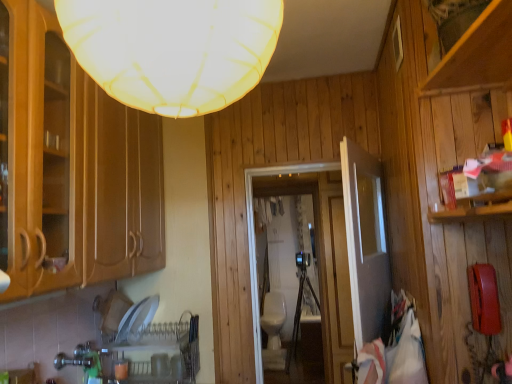
Question: From the image's perspective, is white glossy sink at center positioned above or below transparent glass door at center?

Choices:
 (A) below
 (B) above

Answer: (A)

Question: Is white glossy sink at center in front of or behind transparent glass door at center in the image?

Choices:
 (A) front
 (B) behind

Answer: (B)

Question: Which object is positioned farthest from the transparent glass door at center?

Choices:
 (A) brushed metal faucet at lower left
 (B) white glossy sink at center
 (C) white fabric lampshade at upper center
 (D) white glossy door at center

Answer: (B)

Question: Which of these objects is positioned farthest from the white fabric lampshade at upper center?

Choices:
 (A) white glossy sink at center
 (B) white glossy door at center
 (C) brushed metal faucet at lower left
 (D) transparent glass door at center

Answer: (A)